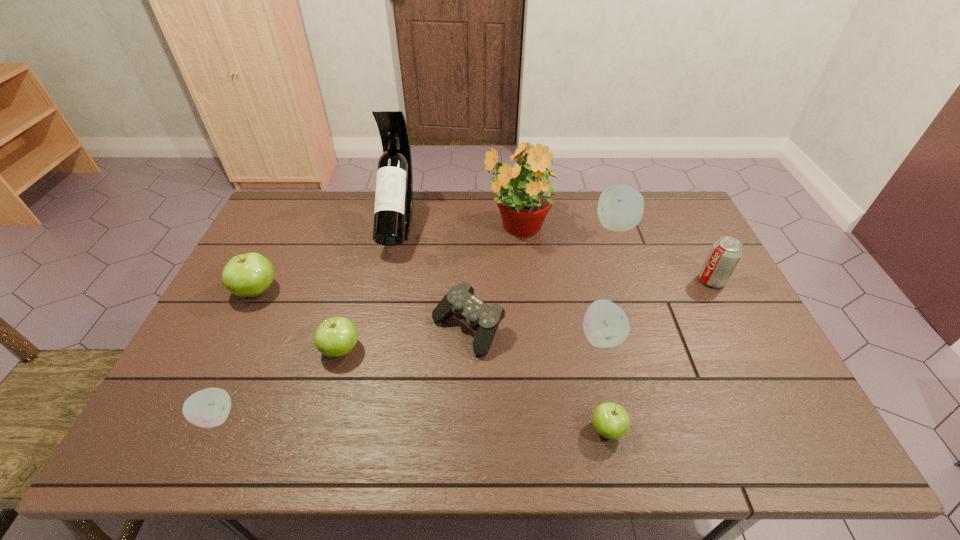
Locate an element on the screen. This screenshot has width=960, height=540. vacant point located on the back of the farthest green apple is located at coordinates (286, 232).

At what (x,y) coordinates should I click in order to perform the action: click on blank area located 0.360m on the front of the gray soda can. Please return your answer as a coordinate pair (x, y). This screenshot has width=960, height=540. Looking at the image, I should click on (774, 400).

At what (x,y) coordinates should I click in order to perform the action: click on free point located 0.230m on the left of the second smallest white apple. Please return your answer as a coordinate pair (x, y). Looking at the image, I should click on (493, 337).

The image size is (960, 540). I want to click on vacant area situated 0.150m on the left of the third apple from left to right, so click(x=263, y=350).

You are a GUI agent. You are given a task and a screenshot of the screen. Output one action in this format:
    pyautogui.click(x=<x>, y=<y>)
    Task: Click on the free space located on the front of the control
    The width and height of the screenshot is (960, 540).
    Given the screenshot: What is the action you would take?
    pyautogui.click(x=466, y=429)

The width and height of the screenshot is (960, 540). I want to click on vacant space located on the right of the smallest white apple, so click(359, 417).

Locate an element on the screen. The width and height of the screenshot is (960, 540). vacant space located 0.150m on the left of the smallest green apple is located at coordinates (523, 429).

Where is `wine bottle located in the far edge section of the desktop`? The width and height of the screenshot is (960, 540). wine bottle located in the far edge section of the desktop is located at coordinates (393, 209).

Find the location of a particular element. The height and width of the screenshot is (540, 960). flowerpot present at the far edge is located at coordinates (523, 189).

Where is `apple present at the far edge`? The width and height of the screenshot is (960, 540). apple present at the far edge is located at coordinates (620, 208).